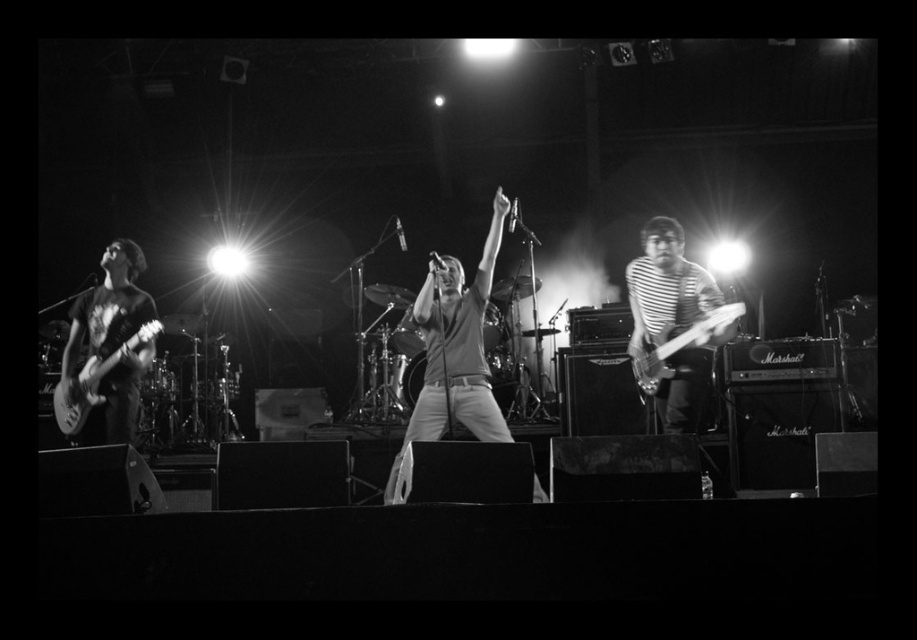
Question: Is striped fabric guitar at right wider than metallic electric guitar at left?

Choices:
 (A) no
 (B) yes

Answer: (A)

Question: Which of the following is the farthest from the observer?

Choices:
 (A) metallic electric guitar at left
 (B) metallic silver guitar at right

Answer: (A)

Question: Which object is closer to the camera taking this photo?

Choices:
 (A) striped fabric guitar at right
 (B) metallic electric guitar at left
 (C) matte gray shirt at center

Answer: (C)

Question: Considering the real-world distances, which object is farthest from the striped fabric guitar at right?

Choices:
 (A) matte gray shirt at center
 (B) metallic silver guitar at right
 (C) metallic electric guitar at left

Answer: (C)

Question: Does matte gray shirt at center have a smaller size compared to metallic silver guitar at right?

Choices:
 (A) yes
 (B) no

Answer: (B)

Question: Is matte gray shirt at center bigger than metallic electric guitar at left?

Choices:
 (A) no
 (B) yes

Answer: (B)